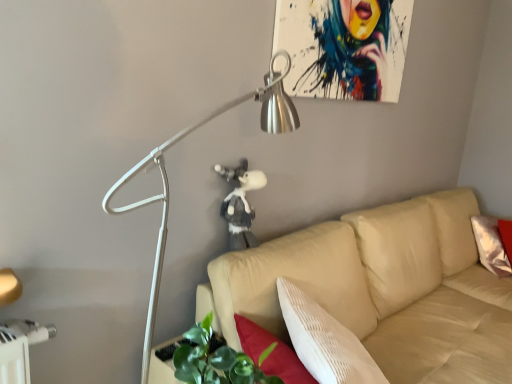
What are the coordinates of `beige fabric couch at center` in the screenshot? It's located at (379, 295).

Where is `fluffy gray plush at center`? fluffy gray plush at center is located at coordinates (240, 204).

Is point (156, 252) positioned after point (372, 241)?

No, (156, 252) is in front of (372, 241).

From the picture: From a real-world perspective, which object stands above the other?

metallic silver lamp at upper left is physically above.

Could you tell me if metallic silver lamp at upper left is turned towards beige fabric couch at center?

No, metallic silver lamp at upper left is not turned towards beige fabric couch at center.

Which of these two, beige fabric couch at center or fluffy gray plush at center, is thinner?

With smaller width is fluffy gray plush at center.

Which object is positioned more to the right, beige fabric couch at center or fluffy gray plush at center?

beige fabric couch at center.

Which object is further away from the camera, beige fabric couch at center or fluffy gray plush at center?

fluffy gray plush at center.

Can you confirm if metallic silver lamp at upper left is thinner than fluffy gray plush at center?

In fact, metallic silver lamp at upper left might be wider than fluffy gray plush at center.

Could you tell me if metallic silver lamp at upper left is turned towards fluffy gray plush at center?

No, metallic silver lamp at upper left does not turn towards fluffy gray plush at center.

From the image's perspective, who appears lower, metallic silver lamp at upper left or fluffy gray plush at center?

metallic silver lamp at upper left appears lower in the image.

Can you tell me how much metallic silver lamp at upper left and fluffy gray plush at center differ in facing direction?

0.495 degrees separate the facing orientations of metallic silver lamp at upper left and fluffy gray plush at center.

Considering their positions, is fluffy gray plush at center located in front of or behind metallic silver lamp at upper left?

fluffy gray plush at center is positioned farther from the viewer than metallic silver lamp at upper left.

Is fluffy gray plush at center facing away from metallic silver lamp at upper left?

No, fluffy gray plush at center's orientation is not away from metallic silver lamp at upper left.

From the picture: From a real-world perspective, between fluffy gray plush at center and metallic silver lamp at upper left, who is vertically lower?

From a 3D spatial view, metallic silver lamp at upper left is below.

Where is `person on the right side of metallic silver lamp at upper left`? The width and height of the screenshot is (512, 384). person on the right side of metallic silver lamp at upper left is located at coordinates (240, 204).

From a real-world perspective, which object stands above the other?

metallic silver lamp at upper left, from a real-world perspective.

Is beige fabric couch at center thinner than metallic silver lamp at upper left?

In fact, beige fabric couch at center might be wider than metallic silver lamp at upper left.

From the image's perspective, is beige fabric couch at center positioned above or below metallic silver lamp at upper left?

beige fabric couch at center is below metallic silver lamp at upper left.

Which of these two, fluffy gray plush at center or beige fabric couch at center, stands shorter?

fluffy gray plush at center.

From a real-world perspective, is fluffy gray plush at center on beige fabric couch at center?

Yes, from a real-world perspective, fluffy gray plush at center is on top of beige fabric couch at center.

From the image's perspective, which one is positioned higher, fluffy gray plush at center or beige fabric couch at center?

fluffy gray plush at center is shown above in the image.

Where is `studio couch lying below the metallic silver lamp at upper left (from the image's perspective)`? This screenshot has height=384, width=512. studio couch lying below the metallic silver lamp at upper left (from the image's perspective) is located at coordinates (379, 295).

Identify the location of studio couch in front of the fluffy gray plush at center. (379, 295).

Consider the image. Based on their spatial positions, is beige fabric couch at center or metallic silver lamp at upper left closer to fluffy gray plush at center?

The object closer to fluffy gray plush at center is metallic silver lamp at upper left.

Based on their spatial positions, is fluffy gray plush at center or metallic silver lamp at upper left closer to beige fabric couch at center?

fluffy gray plush at center is positioned closer to the anchor beige fabric couch at center.

Which object lies nearer to the anchor point fluffy gray plush at center, metallic silver lamp at upper left or beige fabric couch at center?

metallic silver lamp at upper left is closer to fluffy gray plush at center.

Estimate the real-world distances between objects in this image. Which object is closer to beige fabric couch at center, metallic silver lamp at upper left or fluffy gray plush at center?

The object closer to beige fabric couch at center is fluffy gray plush at center.

When comparing their distances from metallic silver lamp at upper left, does fluffy gray plush at center or beige fabric couch at center seem closer?

fluffy gray plush at center lies closer to metallic silver lamp at upper left than the other object.

Based on their spatial positions, is beige fabric couch at center or fluffy gray plush at center closer to metallic silver lamp at upper left?

fluffy gray plush at center.

The image size is (512, 384). I want to click on studio couch between metallic silver lamp at upper left and fluffy gray plush at center from front to back, so click(x=379, y=295).